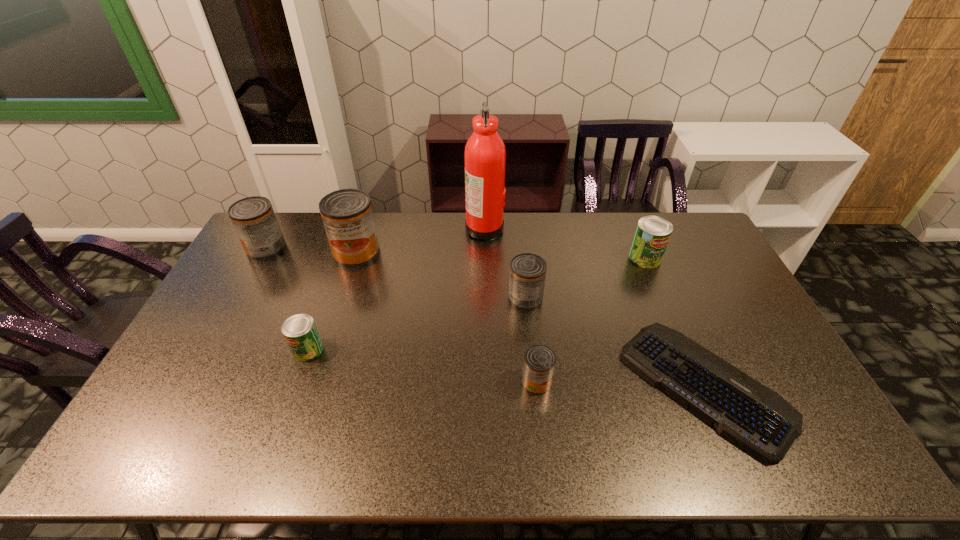
This screenshot has height=540, width=960. I want to click on the left green can, so click(x=300, y=332).

Find the location of a particular element. The height and width of the screenshot is (540, 960). the nearest red can is located at coordinates click(539, 361).

Where is `the smallest red can`? The width and height of the screenshot is (960, 540). the smallest red can is located at coordinates (539, 361).

Where is `the shortest object`? the shortest object is located at coordinates (755, 417).

The image size is (960, 540). Find the location of `vacant space located on the label side of the tallest object`. vacant space located on the label side of the tallest object is located at coordinates (382, 228).

The height and width of the screenshot is (540, 960). I want to click on vacant area situated 0.380m on the label side of the tallest object, so click(x=367, y=228).

Find the location of a particular element. blank area located 0.080m on the label side of the tallest object is located at coordinates (444, 228).

The image size is (960, 540). What are the coordinates of `vacant space located 0.300m on the front of the third red can from right to left` in the screenshot? It's located at (330, 335).

Locate an element on the screen. The width and height of the screenshot is (960, 540). blank area located 0.160m on the back of the third tallest object is located at coordinates (286, 213).

You are a GUI agent. You are given a task and a screenshot of the screen. Output one action in this format:
    pyautogui.click(x=<x>, y=<y>)
    Task: Click on the free location located 0.250m on the left of the farther green can
    
    Given the screenshot: What is the action you would take?
    pyautogui.click(x=559, y=258)